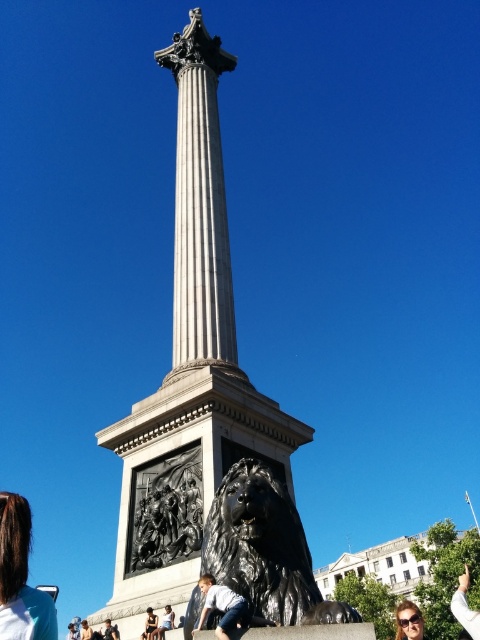
Question: Which is nearer to the white marble column at center?

Choices:
 (A) dark blue jeans at lower center
 (B) polished marble column at center

Answer: (B)

Question: Which point is closer to the camera taking this photo?

Choices:
 (A) (160, 628)
 (B) (305, 588)

Answer: (B)

Question: Which point appears farthest from the camera in this image?

Choices:
 (A) (107, 621)
 (B) (471, 609)
 (C) (155, 637)
 (D) (421, 637)

Answer: (B)

Question: Can you confirm if polished marble column at center is smaller than brown hair at lower left?

Choices:
 (A) no
 (B) yes

Answer: (A)

Question: Does white marble column at center have a larger size compared to dark blue jeans at lower center?

Choices:
 (A) no
 (B) yes

Answer: (B)

Question: Is polished marble column at center further to the viewer compared to matte black sunglasses at lower right?

Choices:
 (A) yes
 (B) no

Answer: (B)